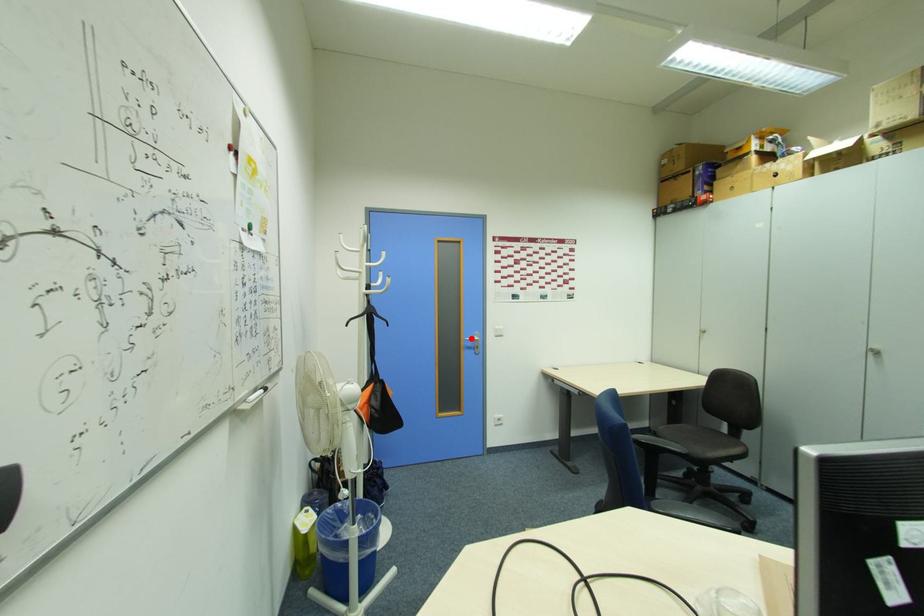
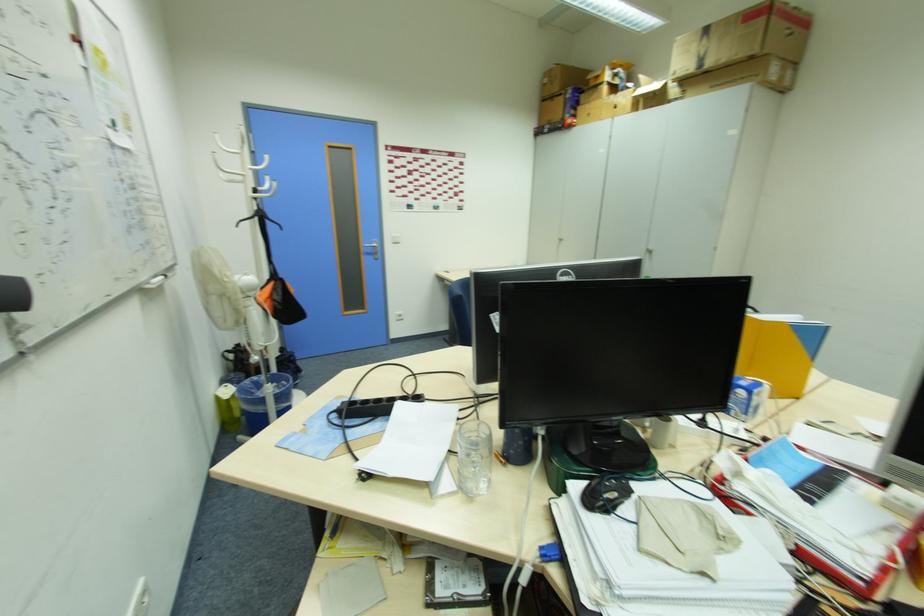
In the second image, find the point that corresponds to the highlighted location in the first image.

(370, 245)